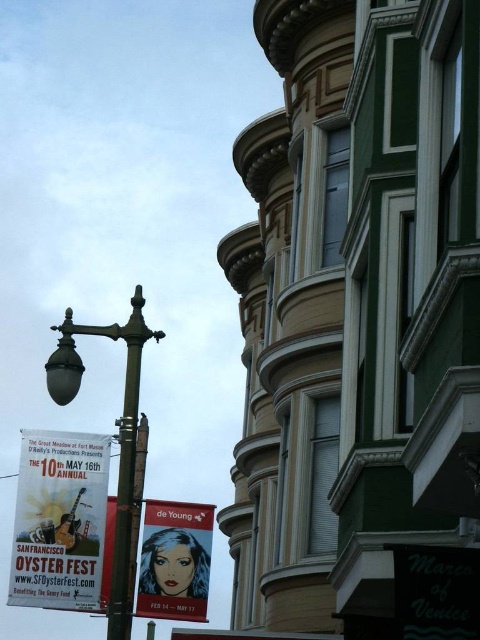
Does polished brass street light at center-left have a lesser width compared to matte red banner at center?

In fact, polished brass street light at center-left might be wider than matte red banner at center.

Locate an element on the screen. The image size is (480, 640). polished brass street light at center-left is located at coordinates (118, 436).

Where is `polished brass street light at center-left`? The height and width of the screenshot is (640, 480). polished brass street light at center-left is located at coordinates (118, 436).

Does white paper poster at lower left have a smaller size compared to metallic pole at center?

Yes.

Who is more distant from viewer, (34, 548) or (124, 454)?

The point (34, 548) is more distant.

Where is `white paper poster at lower left`? The image size is (480, 640). white paper poster at lower left is located at coordinates (60, 520).

Is point (34, 458) closer to camera compared to point (170, 560)?

Yes, it is.

From the picture: Does white paper poster at lower left have a greater height compared to matte red banner at center?

Indeed, white paper poster at lower left has a greater height compared to matte red banner at center.

Does point (56, 547) come behind point (148, 516)?

No.

Identify the location of white paper poster at lower left. The height and width of the screenshot is (640, 480). (60, 520).